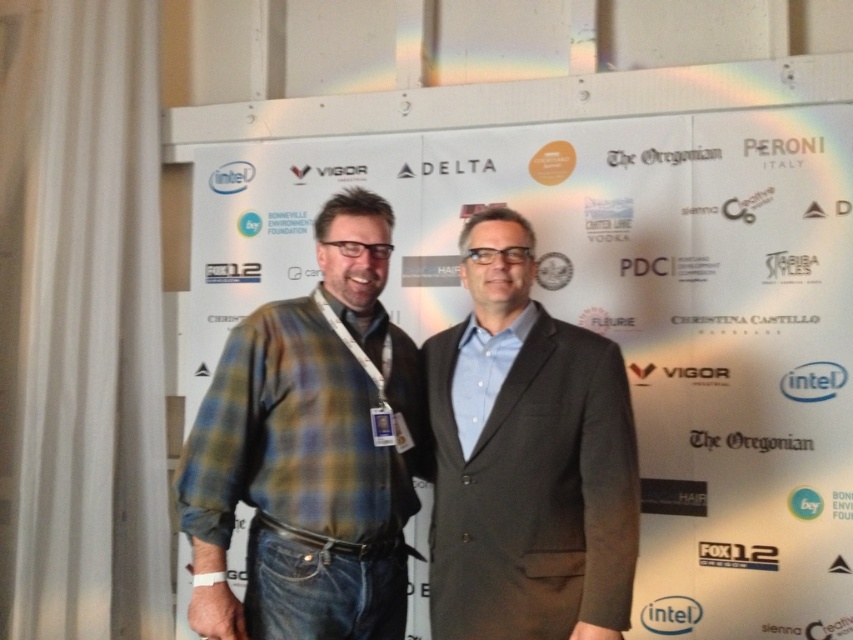
Question: Which point is farther from the camera taking this photo?

Choices:
 (A) (479, 157)
 (B) (254, 330)
 (C) (514, 614)

Answer: (A)

Question: Estimate the real-world distances between objects in this image. Which object is closer to the white paper at center?

Choices:
 (A) plaid flannel shirt at center
 (B) dark gray suit at center

Answer: (B)

Question: Can you confirm if plaid flannel shirt at center is positioned above dark gray suit at center?

Choices:
 (A) yes
 (B) no

Answer: (A)

Question: Which point is closer to the camera?

Choices:
 (A) plaid flannel shirt at center
 (B) white paper at center

Answer: (A)

Question: Can you confirm if plaid flannel shirt at center is positioned to the left of dark gray suit at center?

Choices:
 (A) no
 (B) yes

Answer: (B)

Question: Is white paper at center thinner than plaid flannel shirt at center?

Choices:
 (A) no
 (B) yes

Answer: (A)